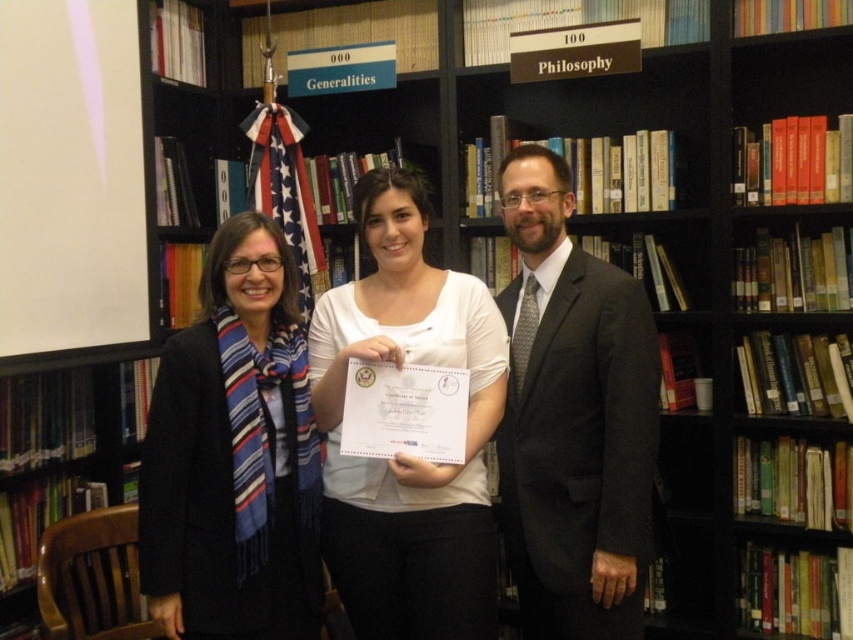
You are standing in a library and see the blue striped scarf at left. Can you estimate its position using a coordinate system where the bottom left corner is the origin?

The blue striped scarf at left is located at coordinates approximately 0.713 on the x axis and 0.275 on the y axis in the given coordinate system.

You are a photographer trying to capture a photo of the dark gray suit at center and the blue striped scarf at left. Based on their heights, which one should you adjust your camera angle to focus on first if you want to ensure both are in frame without moving the subjects?

The blue striped scarf at left is shorter than the dark gray suit at center, so you should first focus on the dark gray suit at center to ensure it is fully in frame, then adjust the angle slightly downward to include the blue striped scarf at left.

You are organizing a presentation and need to place the dark gray suit at center and the white matte certificate at center on a table. The table has a width of 1.2 meters. Can both items fit side by side without overlapping?

The dark gray suit at center is narrower than the white matte certificate at center. However, since the total width of both items combined is not provided, it is impossible to determine if they can fit on the 1.2 meter table without overlapping.